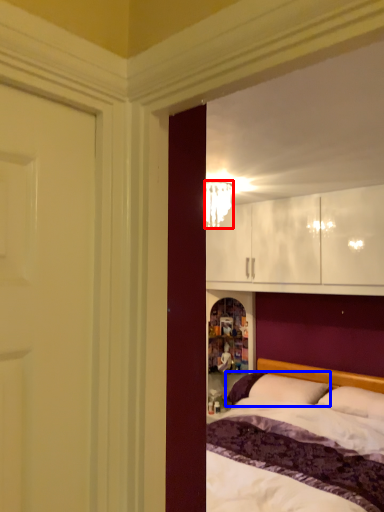
Question: Among these objects, which one is farthest to the camera, lamp (highlighted by a red box) or pillow (highlighted by a blue box)?

Choices:
 (A) lamp
 (B) pillow

Answer: (B)